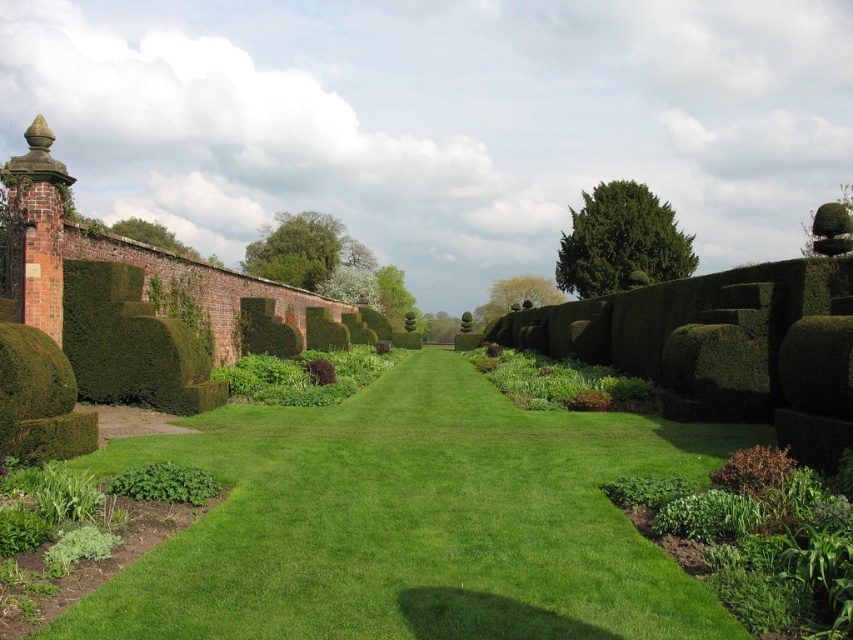
Between green smooth lawn at center and green leafy bush at upper center, which one has less height?

With less height is green smooth lawn at center.

Is green smooth lawn at center shorter than green leafy bush at upper center?

Indeed, green smooth lawn at center has a lesser height compared to green leafy bush at upper center.

Find the location of a particular element. green smooth lawn at center is located at coordinates (413, 522).

Can you confirm if green smooth lawn at center is shorter than green leafy bush at center?

Indeed, green smooth lawn at center has a lesser height compared to green leafy bush at center.

Identify the location of green smooth lawn at center. Image resolution: width=853 pixels, height=640 pixels. (413, 522).

Can you confirm if green leafy bush at upper center is smaller than green leafy bush at center?

No.

Can you confirm if green leafy bush at upper center is positioned to the right of green leafy bush at center?

Correct, you'll find green leafy bush at upper center to the right of green leafy bush at center.

I want to click on green leafy bush at upper center, so click(x=621, y=241).